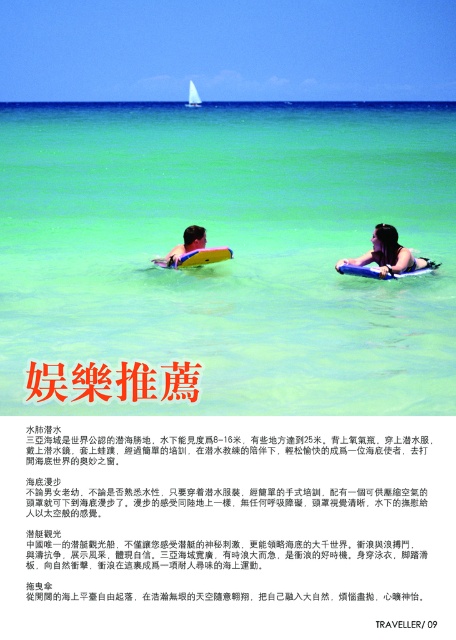
Question: From the image, what is the correct spatial relationship of matte blue foam board at upper center in relation to matte black surfboard at center?

Choices:
 (A) right
 (B) left

Answer: (A)

Question: Among these points, which one is nearest to the camera?

Choices:
 (A) (232, 144)
 (B) (397, 248)

Answer: (B)

Question: Which point is closer to the camera?

Choices:
 (A) (191, 228)
 (B) (193, 112)

Answer: (A)

Question: Among these points, which one is nearest to the camera?

Choices:
 (A) (191, 248)
 (B) (37, 356)
 (C) (409, 253)

Answer: (B)

Question: Can you confirm if transparent blue water at center is positioned above matte black surfboard at center?

Choices:
 (A) no
 (B) yes

Answer: (B)

Question: Where is matte blue foam board at upper center located in relation to matte black surfboard at center in the image?

Choices:
 (A) left
 (B) right

Answer: (B)